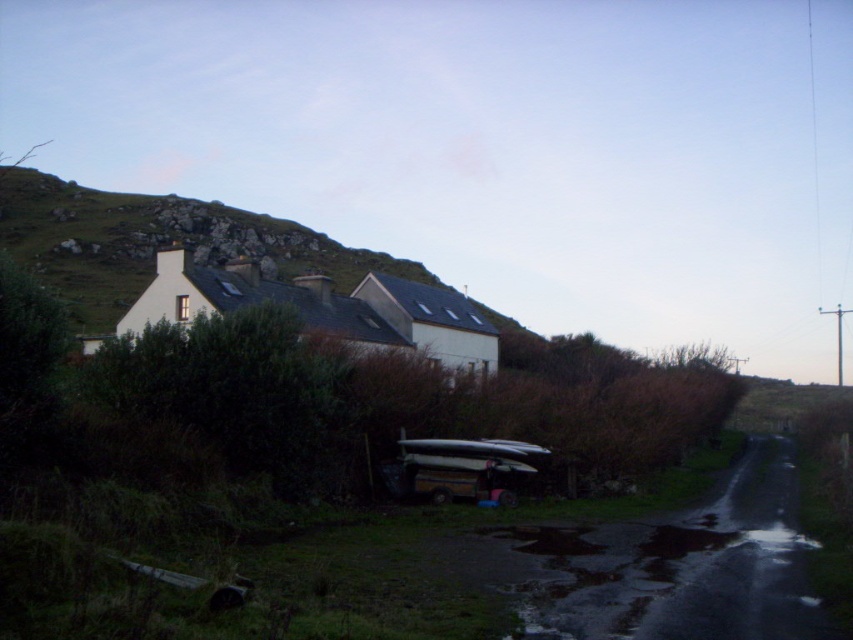
You are standing at the entrance of the house and want to walk towards the point marked as point [157,243]. What will you encounter first?

The point [157,243] is located on the green grassy hillside at upper left, so you will encounter the green grassy hillside at upper left first.

You are standing at the base of the driveway and want to reach the metallic silver canoe at center. Which direction should you look to see the green grassy hillside at upper left relative to the canoe?

The green grassy hillside at upper left is located above the metallic silver canoe at center, so you should look upward from the canoe to see the hillside.